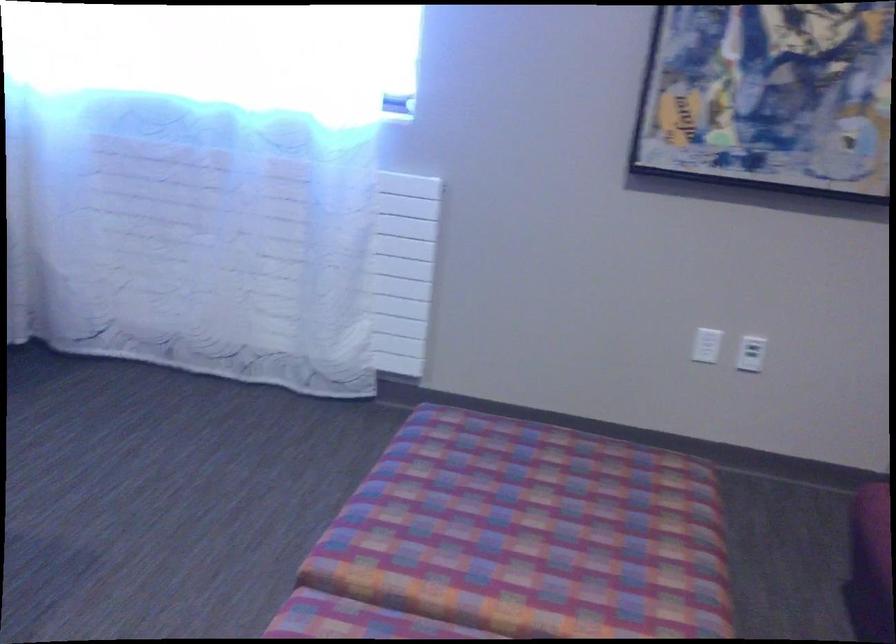
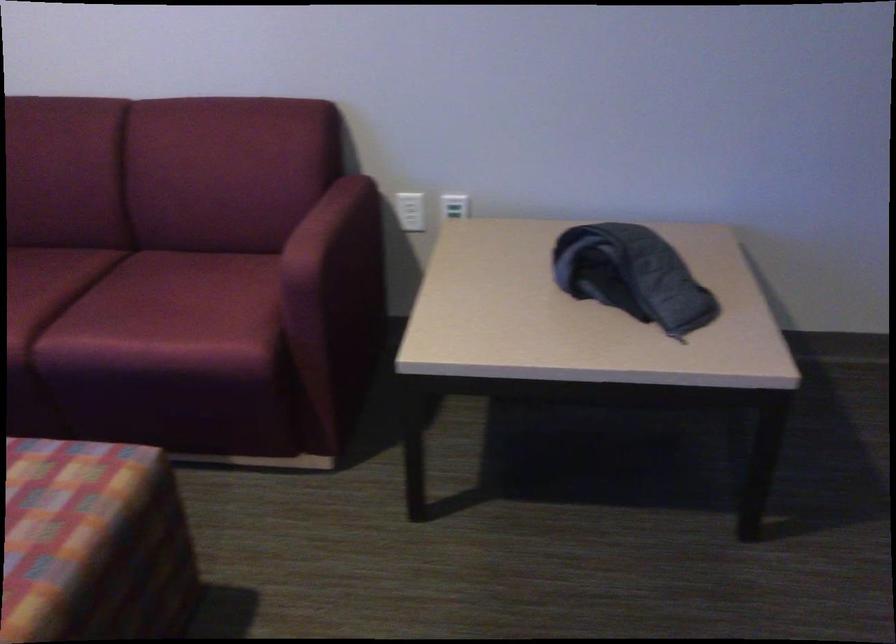
Looking at this image, the images are taken continuously from a first-person perspective. In which direction is your viewpoint rotating?

The rotation direction of the camera is right-down.